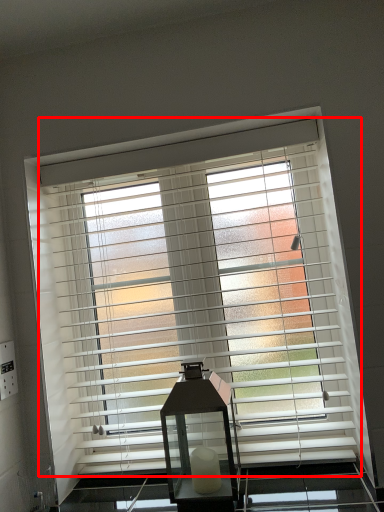
Question: From the image's perspective, what is the correct spatial positioning of window blind (annotated by the red box) in reference to table lamp?

Choices:
 (A) below
 (B) above

Answer: (B)